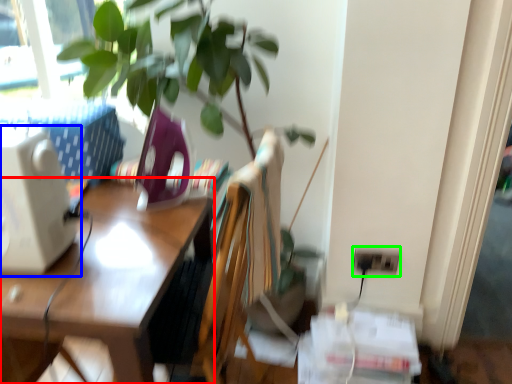
Question: Which object is positioned closest to desk (highlighted by a red box)? Select from desktop computer (highlighted by a blue box) and electric outlet (highlighted by a green box).

Choices:
 (A) desktop computer
 (B) electric outlet

Answer: (A)